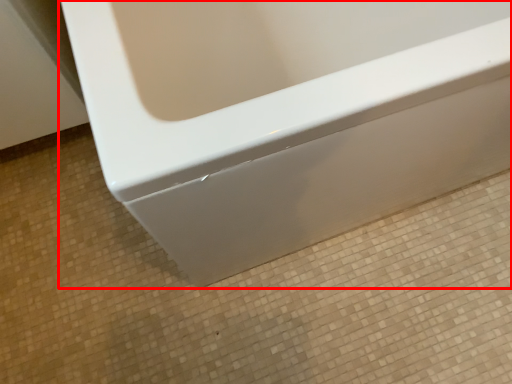
Question: From the image, what is the correct spatial relationship of bathtub (annotated by the red box) in relation to ceramic tile?

Choices:
 (A) right
 (B) left

Answer: (A)